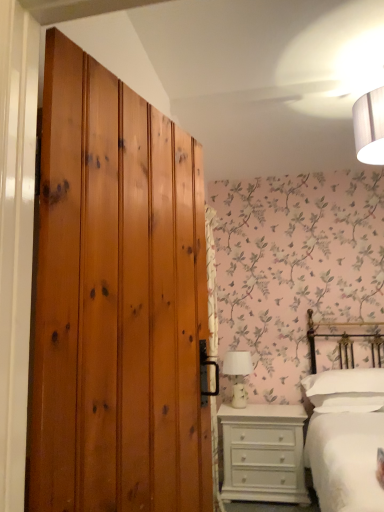
Question: Does white cotton bed at right have a greater width compared to white painted wood chest of drawers at lower right?

Choices:
 (A) yes
 (B) no

Answer: (A)

Question: Is white cotton bed at right oriented away from white painted wood chest of drawers at lower right?

Choices:
 (A) no
 (B) yes

Answer: (A)

Question: Can you confirm if white cotton bed at right is shorter than white painted wood chest of drawers at lower right?

Choices:
 (A) yes
 (B) no

Answer: (B)

Question: Can you confirm if white cotton bed at right is taller than white painted wood chest of drawers at lower right?

Choices:
 (A) no
 (B) yes

Answer: (B)

Question: From a real-world perspective, does white cotton bed at right stand above white painted wood chest of drawers at lower right?

Choices:
 (A) yes
 (B) no

Answer: (A)

Question: Is white painted wood chest of drawers at lower right in front of or behind wooden wardrobe at left in the image?

Choices:
 (A) behind
 (B) front

Answer: (A)

Question: Does point (286, 411) appear closer or farther from the camera than point (142, 302)?

Choices:
 (A) farther
 (B) closer

Answer: (A)

Question: Is white painted wood chest of drawers at lower right spatially inside wooden wardrobe at left, or outside of it?

Choices:
 (A) outside
 (B) inside

Answer: (A)

Question: From the image's perspective, is white painted wood chest of drawers at lower right positioned above or below wooden wardrobe at left?

Choices:
 (A) below
 (B) above

Answer: (A)

Question: Would you say white cotton bed at right is to the left or to the right of white soft pillow at right in the picture?

Choices:
 (A) right
 (B) left

Answer: (B)

Question: Does point (316, 468) appear closer or farther from the camera than point (314, 395)?

Choices:
 (A) closer
 (B) farther

Answer: (A)

Question: From a real-world perspective, is white cotton bed at right physically located above or below white soft pillow at right?

Choices:
 (A) below
 (B) above

Answer: (A)

Question: Based on their sizes in the image, would you say white cotton bed at right is bigger or smaller than white soft pillow at right?

Choices:
 (A) small
 (B) big

Answer: (B)

Question: Is white soft pillow at right in front of or behind white ceramic table lamp at center in the image?

Choices:
 (A) front
 (B) behind

Answer: (A)

Question: From the image's perspective, is white soft pillow at right above or below white ceramic table lamp at center?

Choices:
 (A) above
 (B) below

Answer: (B)